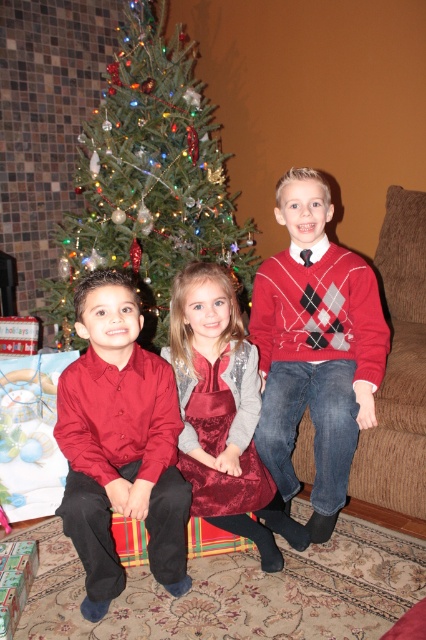
You are a photographer trying to capture a clear photo of the argyle sweater at center and the matte red shirt at center. Which one will appear closer to you in the photo?

The argyle sweater at center will appear closer to you in the photo because it is positioned further to the viewer than the matte red shirt at center.

You are standing in the living room and want to hand a gift to the child wearing the matte red shirt at center. The gift is placed on the green textured christmas tree at upper center. Can you reach the gift without moving the tree?

The green textured christmas tree at upper center is further to the viewer than the matte red shirt at center, so you can reach the gift on the green textured christmas tree at upper center without needing to move it because it is closer to you than the child wearing the matte red shirt at center.

You are a photographer trying to capture a group photo of the children in front of the Christmas tree. You notice the argyle sweater at center and the matte red shirt at center. Which clothing item should you focus on to ensure it stands out more in the photo?

The argyle sweater at center is bigger than the matte red shirt at center, so focusing on the argyle sweater at center will make it stand out more in the photo.